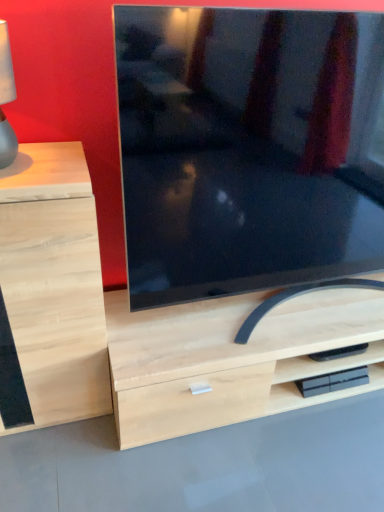
Question: From the image's perspective, is matte black tv at center beneath light wood drawer at left?

Choices:
 (A) yes
 (B) no

Answer: (B)

Question: Can you confirm if matte black tv at center is wider than light wood drawer at left?

Choices:
 (A) yes
 (B) no

Answer: (B)

Question: Is there a large distance between matte black tv at center and light wood drawer at left?

Choices:
 (A) no
 (B) yes

Answer: (A)

Question: From a real-world perspective, is matte black tv at center physically above light wood drawer at left?

Choices:
 (A) yes
 (B) no

Answer: (A)

Question: Is matte black tv at center shorter than light wood drawer at left?

Choices:
 (A) no
 (B) yes

Answer: (A)

Question: From the image's perspective, is matte black tv at center located above light wood drawer at left?

Choices:
 (A) no
 (B) yes

Answer: (B)

Question: Would you consider matte black tv at center to be distant from matte gray lampshade at left?

Choices:
 (A) no
 (B) yes

Answer: (A)

Question: From the image's perspective, is matte black tv at center under matte gray lampshade at left?

Choices:
 (A) yes
 (B) no

Answer: (A)

Question: Is matte black tv at center behind matte gray lampshade at left?

Choices:
 (A) no
 (B) yes

Answer: (A)

Question: From a real-world perspective, is matte black tv at center located higher than matte gray lampshade at left?

Choices:
 (A) no
 (B) yes

Answer: (A)

Question: Considering the relative sizes of matte black tv at center and matte gray lampshade at left in the image provided, is matte black tv at center taller than matte gray lampshade at left?

Choices:
 (A) no
 (B) yes

Answer: (B)

Question: Is matte black tv at center turned away from matte gray lampshade at left?

Choices:
 (A) no
 (B) yes

Answer: (A)

Question: Is light wood drawer at left positioned beyond the bounds of matte black tv at center?

Choices:
 (A) no
 (B) yes

Answer: (B)